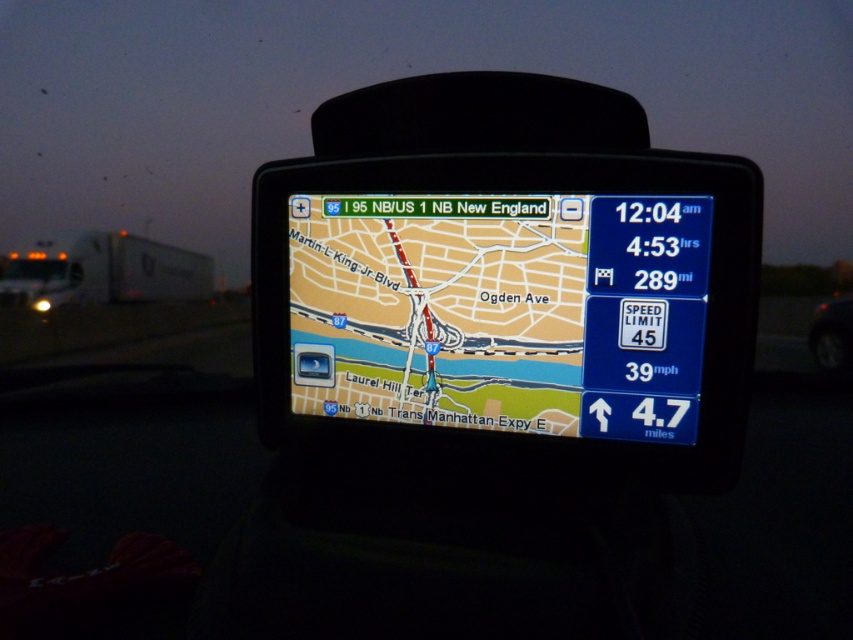
Question: Can you confirm if beige paper map at center is smaller than shiny black tire at lower right?

Choices:
 (A) no
 (B) yes

Answer: (A)

Question: Is beige paper map at center above shiny black tire at lower right?

Choices:
 (A) no
 (B) yes

Answer: (B)

Question: Is beige paper map at center wider than shiny black tire at lower right?

Choices:
 (A) no
 (B) yes

Answer: (B)

Question: Which object appears farthest from the camera in this image?

Choices:
 (A) beige paper map at center
 (B) shiny black tire at lower right

Answer: (B)

Question: Which object appears closest to the camera in this image?

Choices:
 (A) shiny black tire at lower right
 (B) beige paper map at center

Answer: (B)

Question: Which point is farther to the camera?

Choices:
 (A) shiny black tire at lower right
 (B) beige paper map at center

Answer: (A)